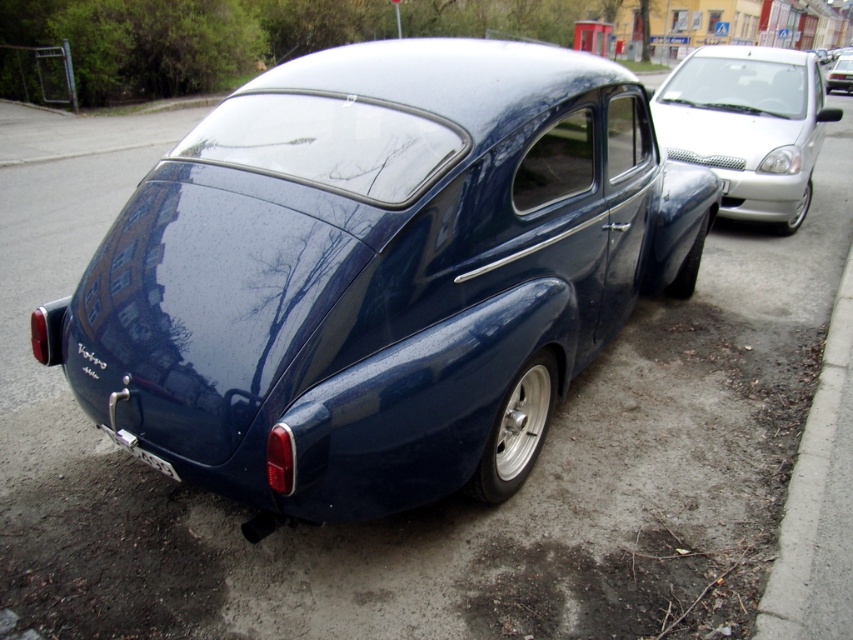
You are a delivery person trying to park your van behind the glossy blue car at center and the white glossy sedan at right. According to the scene, can you park your van behind both vehicles?

The glossy blue car at center is positioned under the white glossy sedan at right, so there is no space behind both vehicles to park your van.

Based on the photo, you are a parking attendant who needs to fit both cars into a parking space that is exactly as wide as the glossy blue car at center. Can the white glossy sedan at right fit into the same space without overlapping?

The glossy blue car at center is wider than the white glossy sedan at right, so the white glossy sedan at right can fit into the same parking space without overlapping since it is narrower.

You are a delivery person trying to park a white glossy sedan at right in a narrow alley next to a matte black bumper at rear. Can the sedan fit if the alley is only as wide as the bumper?

The white glossy sedan at right is wider than the matte black bumper at rear, so if the alley is only as wide as the bumper, the sedan might not fit properly due to its greater width.